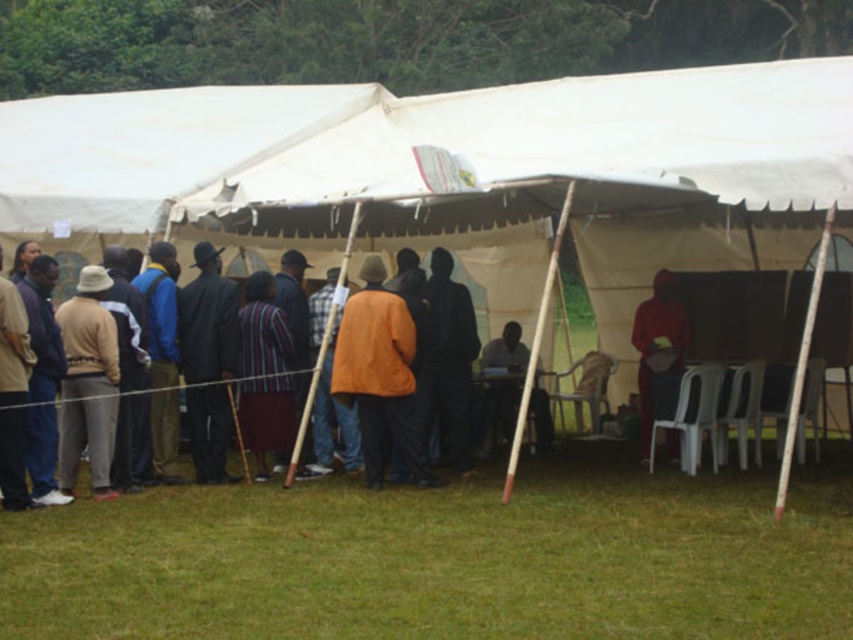
You are a photographer trying to capture a clear shot of the dark brown leather chair at center without the matte beige hat at left blocking it. How should you adjust your position?

The matte beige hat at left is positioned over the dark brown leather chair at center, so to avoid the hat blocking the chair, you should move your camera position lower or shift to a side angle where the hat is no longer above the chair.

Based on the photo, you are standing at point (4, 484) and want to walk to the other side of the tent. The tent is 9.65 meters wide. Can you walk straight through the center of the tent to reach the other side without going around?

The distance between you and the other side of the tent is 9.65 meters. Since the tent is 9.65 meters wide, walking straight through the center would require covering that distance, so yes, you can walk straight through the center of the tent to reach the other side without going around.